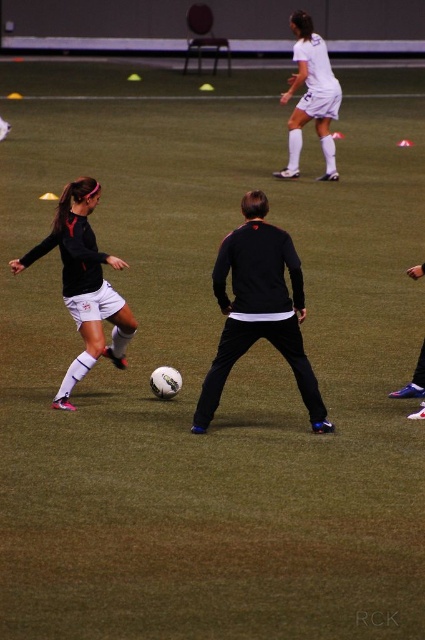
Question: Which is farther from the black matte jacket at center?

Choices:
 (A) matte black soccer ball at center
 (B) white matte soccer player at upper center

Answer: (B)

Question: Observing the image, what is the correct spatial positioning of black matte jacket at center in reference to matte black soccer ball at center?

Choices:
 (A) right
 (B) left

Answer: (A)

Question: Which of the following is the farthest from the observer?

Choices:
 (A) (336, 96)
 (B) (113, 262)

Answer: (A)

Question: Does matte black soccer ball at center have a smaller size compared to white matte soccer player at upper center?

Choices:
 (A) yes
 (B) no

Answer: (B)

Question: Which point is closer to the camera?

Choices:
 (A) white matte soccer player at upper center
 (B) black matte jacket at center

Answer: (B)

Question: Is matte black soccer ball at center to the left of white matte soccer player at upper center from the viewer's perspective?

Choices:
 (A) yes
 (B) no

Answer: (A)